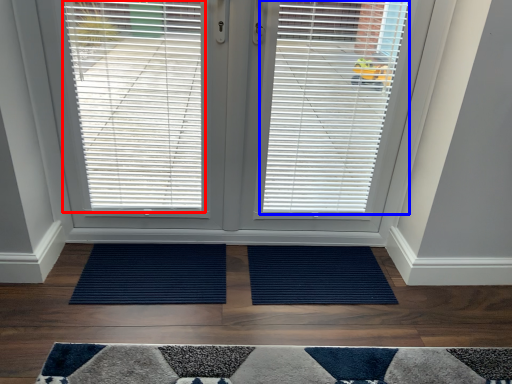
Question: Which object appears farthest to the camera in this image, window blind (highlighted by a red box) or window blind (highlighted by a blue box)?

Choices:
 (A) window blind
 (B) window blind

Answer: (B)